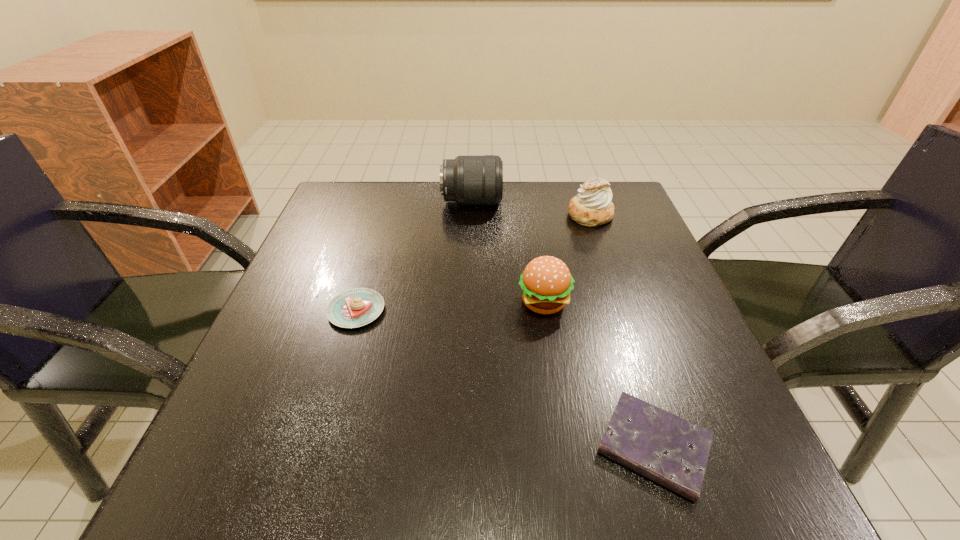
What are the coordinates of `vacant region between the second object from left to right and the shortest object` in the screenshot? It's located at (563, 324).

Image resolution: width=960 pixels, height=540 pixels. I want to click on free space between the hamburger and the tallest object, so click(x=508, y=252).

Find the location of a particular element. The image size is (960, 540). free space between the telephoto lens and the farther pastry is located at coordinates (531, 208).

Find the location of a particular element. free area in between the taller pastry and the nearest object is located at coordinates (622, 331).

Where is `vacant region between the tallest object and the hamburger`? vacant region between the tallest object and the hamburger is located at coordinates (508, 252).

What are the coordinates of `free space between the telephoto lens and the left pastry` in the screenshot? It's located at tap(414, 256).

Identify the location of empty space between the fourth object from right to left and the shortest object. (563, 324).

Where is `free space between the left pastry and the taller pastry`? free space between the left pastry and the taller pastry is located at coordinates (473, 262).

Identify the location of free spot between the shortest object and the second object from left to right. This screenshot has width=960, height=540. (563, 324).

Find the location of a particular element. The height and width of the screenshot is (540, 960). object that is the nearest to the left pastry is located at coordinates (546, 283).